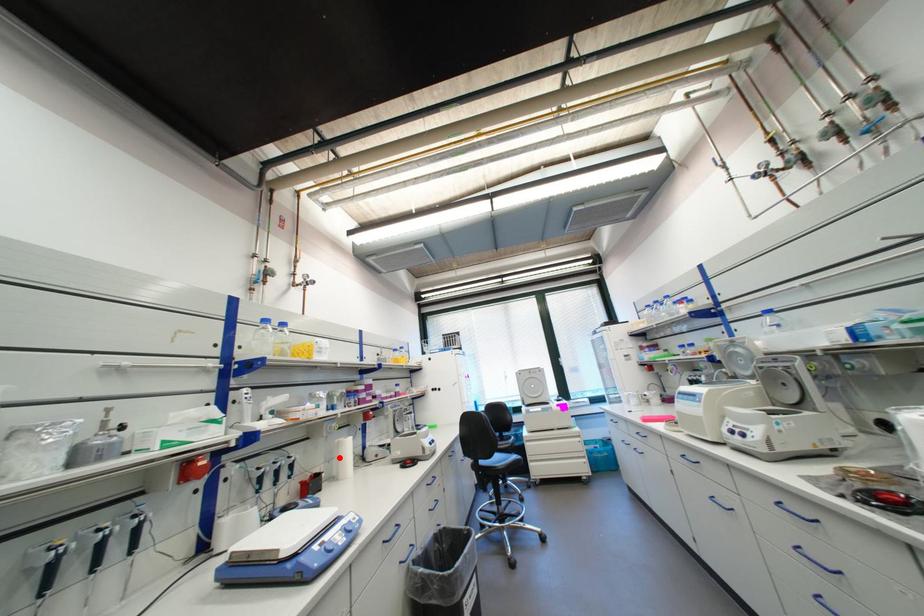
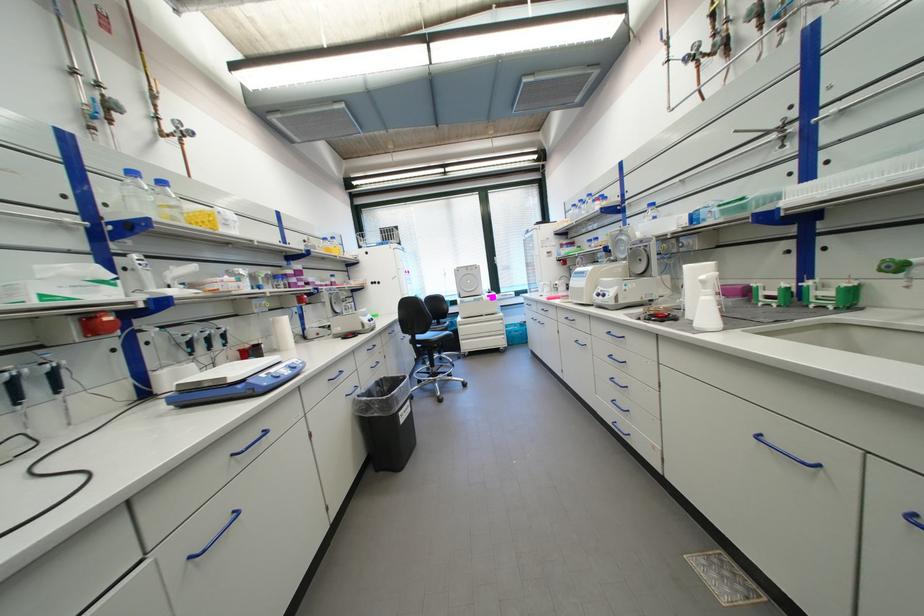
In the second image, find the point that corresponds to the highlighted location in the first image.

(276, 334)